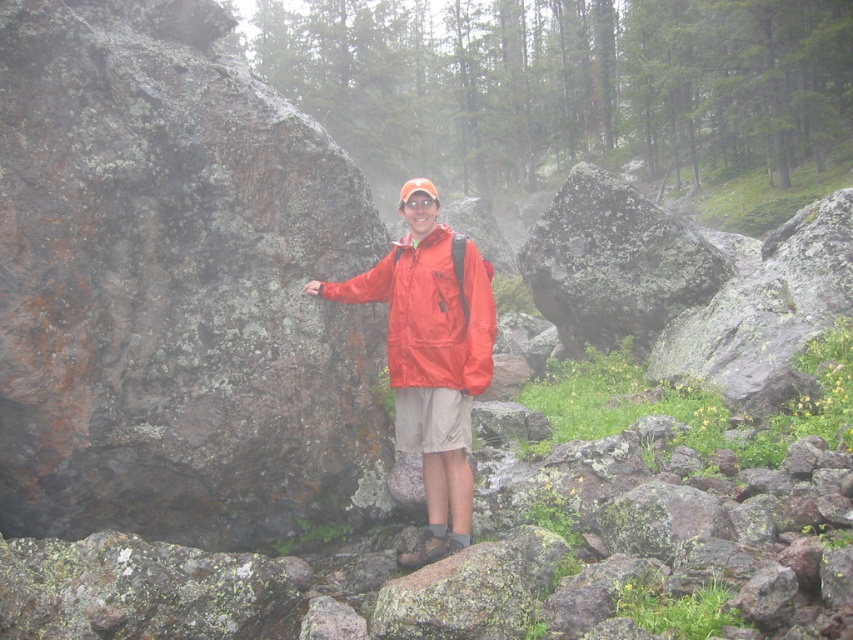
Question: Which of the following is the closest to the observer?

Choices:
 (A) (283, 433)
 (B) (473, 348)
 (C) (589, 196)
 (D) (389, 317)

Answer: (B)

Question: Considering the relative positions of rusty rock at left and matte red jacket at center in the image provided, where is rusty rock at left located with respect to matte red jacket at center?

Choices:
 (A) below
 (B) above

Answer: (B)

Question: Which point is farther from the camera taking this photo?

Choices:
 (A) (326, 173)
 (B) (439, 524)
 (C) (419, 352)

Answer: (A)

Question: Is green mossy rock at center to the left of matte red jacket at center from the viewer's perspective?

Choices:
 (A) yes
 (B) no

Answer: (B)

Question: Observing the image, what is the correct spatial positioning of rusty rock at left in reference to green mossy rock at center?

Choices:
 (A) above
 (B) below

Answer: (A)

Question: Which object is farther from the camera taking this photo?

Choices:
 (A) matte red jacket at center
 (B) matte orange jacket at center
 (C) rusty rock at left

Answer: (B)